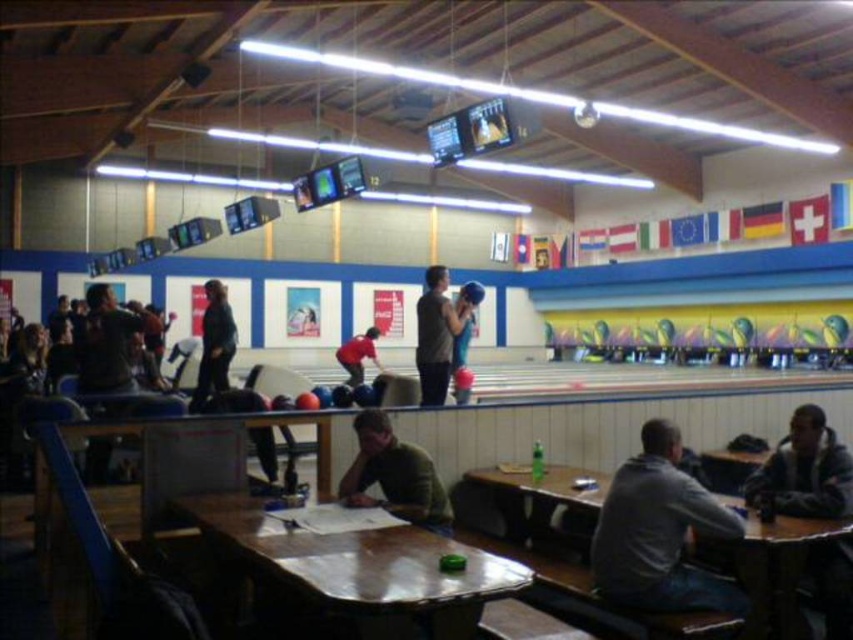
Does wooden table at center have a larger size compared to wooden table at lower right?

Yes.

Where is `wooden table at center`? The width and height of the screenshot is (853, 640). wooden table at center is located at coordinates click(363, 566).

Between point (186, 496) and point (582, 474), which one is positioned in front?

Point (186, 496) is in front.

The width and height of the screenshot is (853, 640). I want to click on wooden table at center, so click(363, 566).

Can you confirm if wooden table at lower right is smaller than red fabric shirt at center?

Correct, wooden table at lower right occupies less space than red fabric shirt at center.

Between wooden table at lower right and red fabric shirt at center, which one is positioned higher?

red fabric shirt at center is higher up.

This screenshot has height=640, width=853. I want to click on wooden table at lower right, so click(x=778, y=570).

Between green matte shirt at lower center and blue fabric shirt at center, which one appears on the left side from the viewer's perspective?

From the viewer's perspective, green matte shirt at lower center appears more on the left side.

Is green matte shirt at lower center to the right of blue fabric shirt at center from the viewer's perspective?

No, green matte shirt at lower center is not to the right of blue fabric shirt at center.

In the scene shown: Who is more distant from viewer, (422, 458) or (469, 339)?

The point (469, 339) is more distant.

Locate an element on the screen. The width and height of the screenshot is (853, 640). green matte shirt at lower center is located at coordinates pos(393,476).